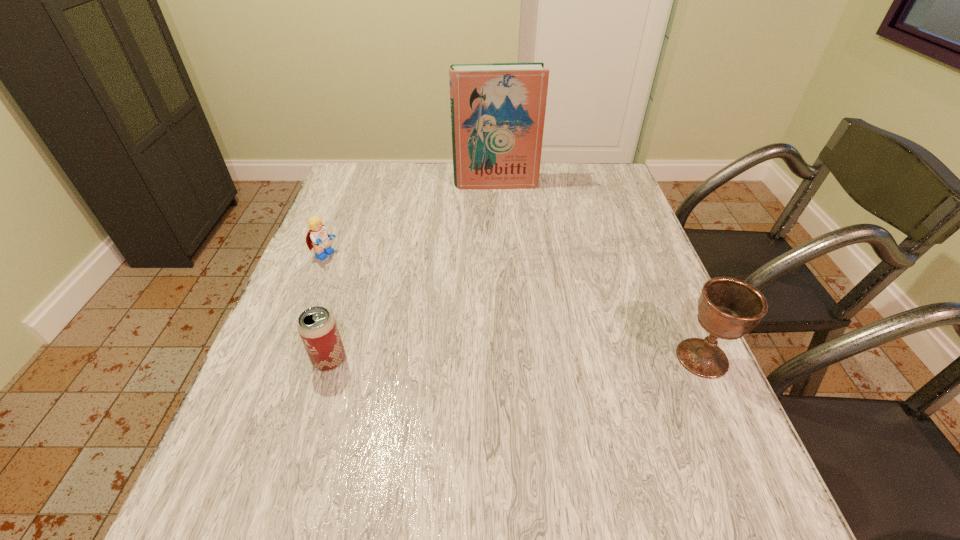
The image size is (960, 540). In order to click on free space between the third object from left to right and the second tallest object in this screenshot , I will do `click(599, 271)`.

Find the location of a particular element. vacant space that is in between the tallest object and the second object from left to right is located at coordinates (413, 272).

Image resolution: width=960 pixels, height=540 pixels. I want to click on empty space that is in between the Lego and the farthest object, so click(x=410, y=220).

Image resolution: width=960 pixels, height=540 pixels. In order to click on empty space between the third shortest object and the hardback book in this screenshot , I will do `click(599, 271)`.

Locate an element on the screen. This screenshot has height=540, width=960. free spot between the hardback book and the rightmost object is located at coordinates (599, 271).

Where is `object that stands as the second closest to the hardback book`? The height and width of the screenshot is (540, 960). object that stands as the second closest to the hardback book is located at coordinates (728, 308).

Identify which object is located as the second nearest to the beer can. Please provide its 2D coordinates. Your answer should be formatted as a tuple, i.e. [(x, y)], where the tuple contains the x and y coordinates of a point satisfying the conditions above.

[(498, 110)]

This screenshot has height=540, width=960. What are the coordinates of `vacant space that satisfies the following two spatial constraints: 1. on the front side of the second farthest object; 2. on the left side of the third shortest object` in the screenshot? It's located at (284, 358).

Image resolution: width=960 pixels, height=540 pixels. Find the location of `vacant area in the image that satisfies the following two spatial constraints: 1. on the front side of the rightmost object; 2. on the left side of the second object from right to left`. vacant area in the image that satisfies the following two spatial constraints: 1. on the front side of the rightmost object; 2. on the left side of the second object from right to left is located at coordinates (504, 358).

Where is `free space that satisfies the following two spatial constraints: 1. on the front side of the tallest object; 2. on the left side of the chalice`? This screenshot has height=540, width=960. free space that satisfies the following two spatial constraints: 1. on the front side of the tallest object; 2. on the left side of the chalice is located at coordinates (504, 358).